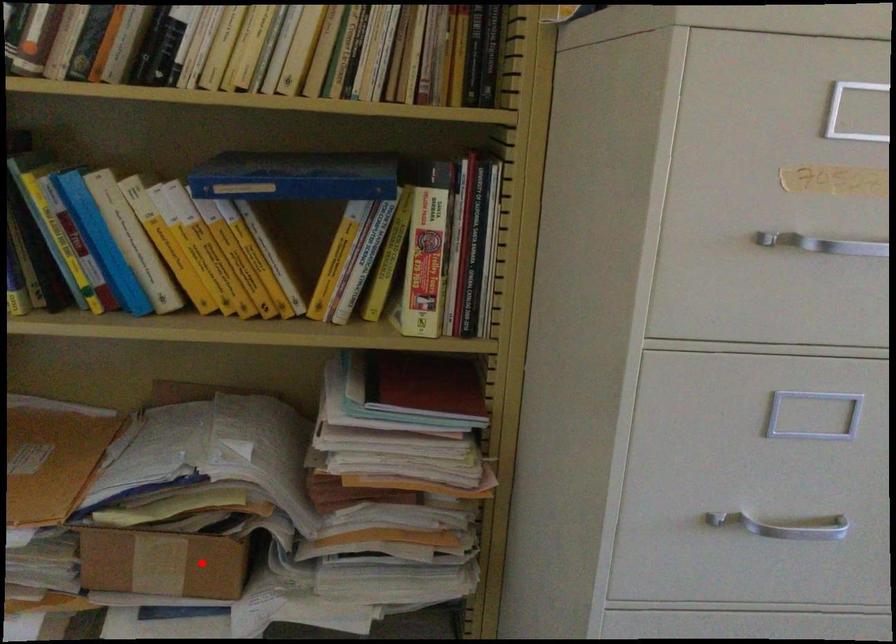
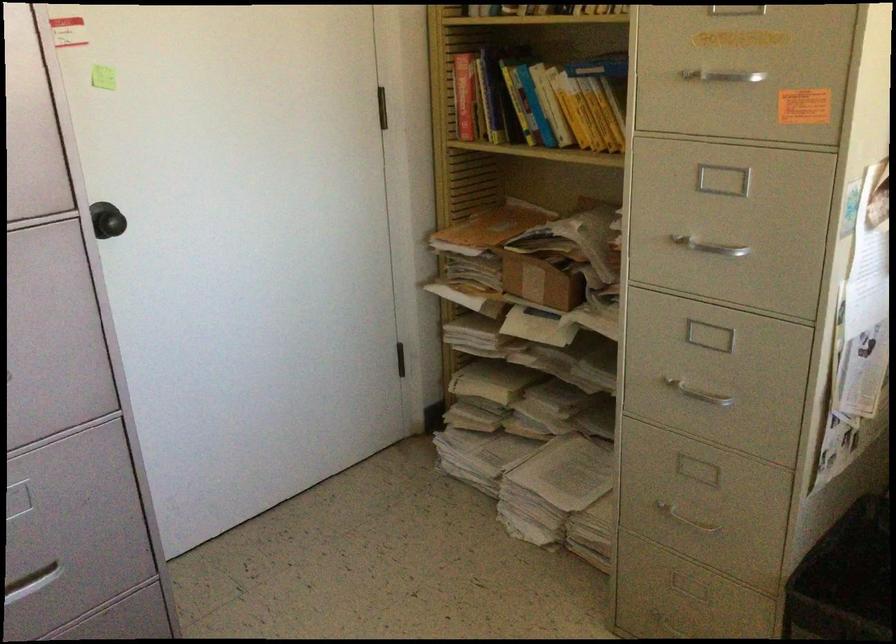
The point at the highlighted location is marked in the first image. Where is the corresponding point in the second image?

(539, 281)